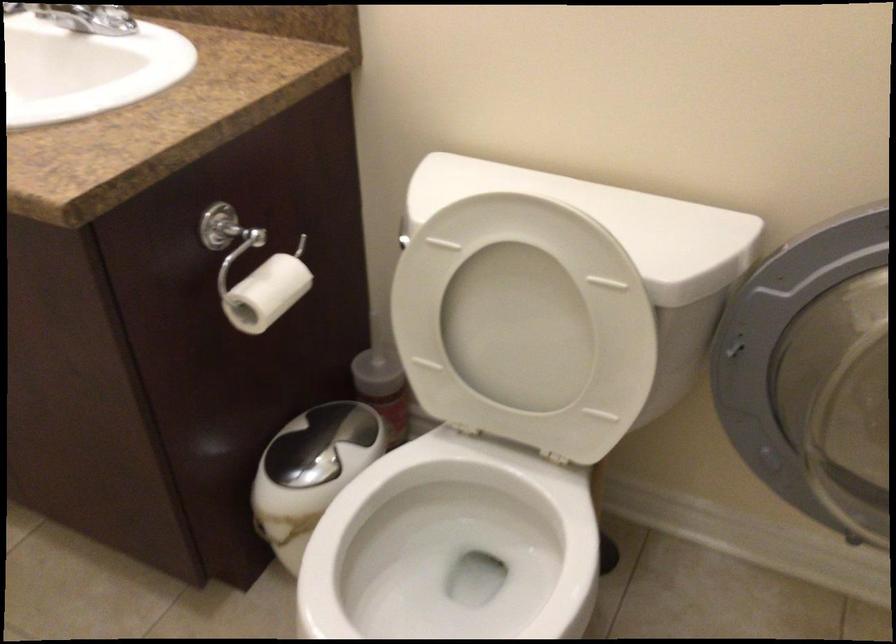
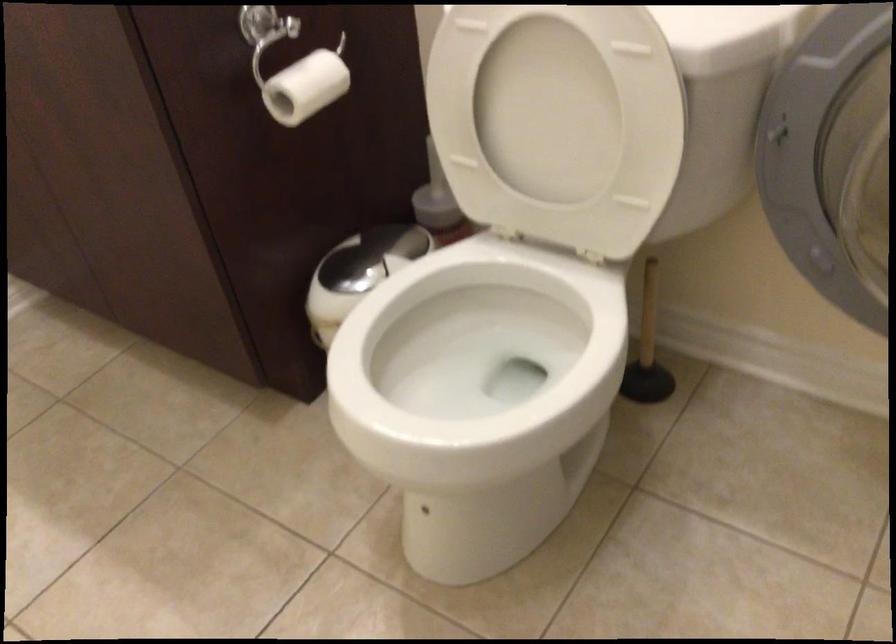
Question: The camera is either moving clockwise (left) or counter-clockwise (right) around the object. The first image is from the beginning of the video and the second image is from the end. Is the camera moving left or right when shooting the video?

Choices:
 (A) Left
 (B) Right

Answer: (B)